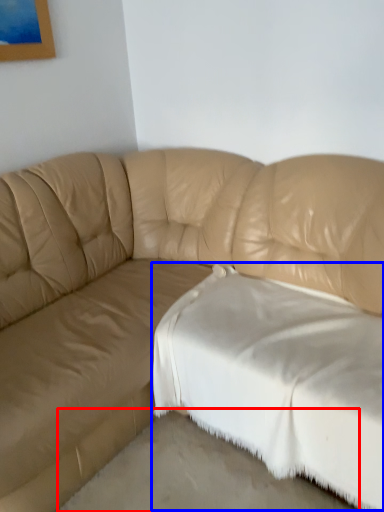
Question: Which of the following is the farthest to the observer, concrete (highlighted by a red box) or sheet (highlighted by a blue box)?

Choices:
 (A) concrete
 (B) sheet

Answer: (B)